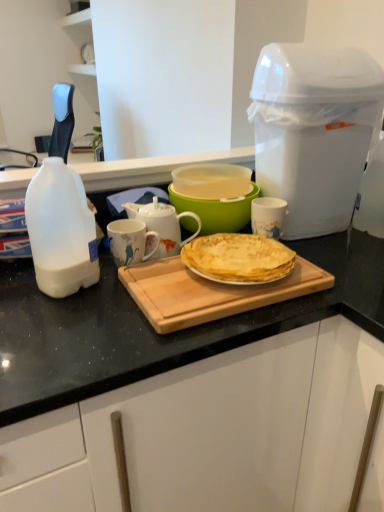
Image resolution: width=384 pixels, height=512 pixels. Identify the location of vacant area on top of wooden cutting board at center (from a real-world perspective). (193, 281).